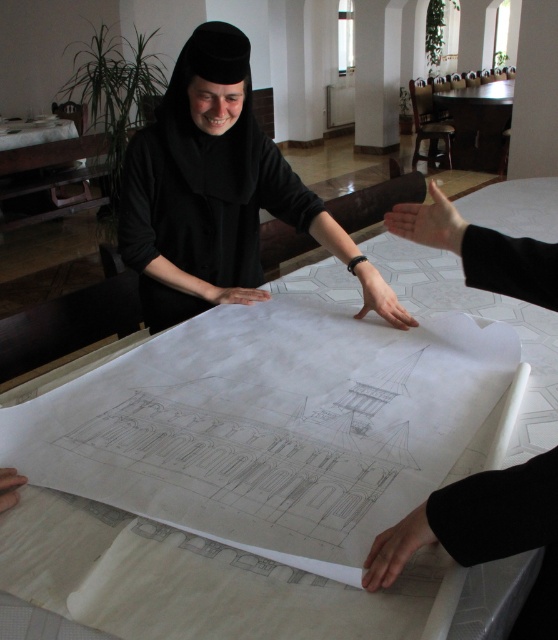
From the picture: You are an architect reviewing a blueprint in a large room. You notice the white paper at center and the black matte hand at center. Which object is closer to you, the observer?

The black matte hand at center is closer to you because it is above the white paper at center, which is located below it.

You are an architect reviewing the blueprint. You notice the white paper at center and the black matte hand at center. Which object is bigger in size?

The white paper at center is larger in size than the black matte hand at center.